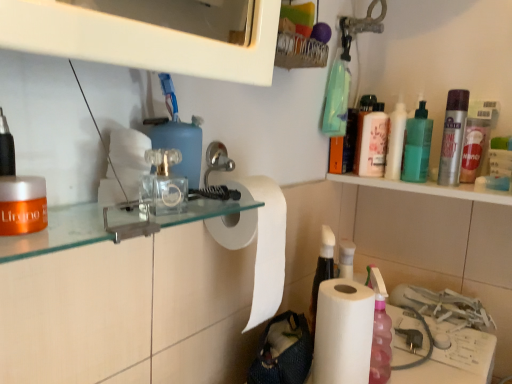
Question: Can you see orange matte jar at left touching silver metallic mouthwash at upper right, arranged as the 2th mouthwash when viewed from the front?

Choices:
 (A) yes
 (B) no

Answer: (B)

Question: Is orange matte jar at left at the left side of silver metallic mouthwash at upper right, arranged as the first mouthwash when viewed from the right?

Choices:
 (A) yes
 (B) no

Answer: (A)

Question: Does orange matte jar at left have a lesser height compared to silver metallic mouthwash at upper right, positioned as the 4th mouthwash in left-to-right order?

Choices:
 (A) yes
 (B) no

Answer: (A)

Question: Is orange matte jar at left at the right side of silver metallic mouthwash at upper right, the 3th mouthwash from the back?

Choices:
 (A) yes
 (B) no

Answer: (B)

Question: Is orange matte jar at left positioned with its back to silver metallic mouthwash at upper right, positioned as the 4th mouthwash in left-to-right order?

Choices:
 (A) no
 (B) yes

Answer: (A)

Question: Is white matte paper towel at center, the 2th paper towel in the right-to-left sequence, in front of or behind silver metallic mouthwash at upper right, the 3th mouthwash from the back, in the image?

Choices:
 (A) behind
 (B) front

Answer: (B)

Question: From the image's perspective, is white matte paper towel at center, which is counted as the 1th paper towel, starting from the left, above or below silver metallic mouthwash at upper right, arranged as the first mouthwash when viewed from the right?

Choices:
 (A) below
 (B) above

Answer: (A)

Question: From a real-world perspective, is white matte paper towel at center, which is counted as the 1th paper towel, starting from the left, physically located above or below silver metallic mouthwash at upper right, the 3th mouthwash from the back?

Choices:
 (A) below
 (B) above

Answer: (A)

Question: Considering the positions of white matte paper towel at center, which is counted as the 1th paper towel, starting from the left, and silver metallic mouthwash at upper right, arranged as the 2th mouthwash when viewed from the front, in the image, is white matte paper towel at center, which is counted as the 1th paper towel, starting from the left, bigger or smaller than silver metallic mouthwash at upper right, arranged as the 2th mouthwash when viewed from the front,?

Choices:
 (A) small
 (B) big

Answer: (B)

Question: Looking at their shapes, would you say white paper at lower right, which ranks as the 1th paper towel in right-to-left order, is wider or thinner than clear plastic toilet paper at center?

Choices:
 (A) wide
 (B) thin

Answer: (A)

Question: From a real-world perspective, relative to clear plastic toilet paper at center, is white paper at lower right, the second paper towel in the left-to-right sequence, vertically above or below?

Choices:
 (A) above
 (B) below

Answer: (B)

Question: Is white paper at lower right, which ranks as the 1th paper towel in right-to-left order, spatially inside clear plastic toilet paper at center, or outside of it?

Choices:
 (A) inside
 (B) outside

Answer: (B)

Question: Based on their sizes in the image, would you say white paper at lower right, which ranks as the 1th paper towel in right-to-left order, is bigger or smaller than clear plastic toilet paper at center?

Choices:
 (A) small
 (B) big

Answer: (B)

Question: Based on their positions, is green translucent bottle at upper right, the second mouthwash in the right-to-left sequence, located to the left or right of pink glossy mouthwash at upper right, which is the first mouthwash in back-to-front order?

Choices:
 (A) left
 (B) right

Answer: (B)

Question: Based on their sizes in the image, would you say green translucent bottle at upper right, the second mouthwash in the right-to-left sequence, is bigger or smaller than pink glossy mouthwash at upper right, marked as the 4th mouthwash in a front-to-back arrangement?

Choices:
 (A) small
 (B) big

Answer: (B)